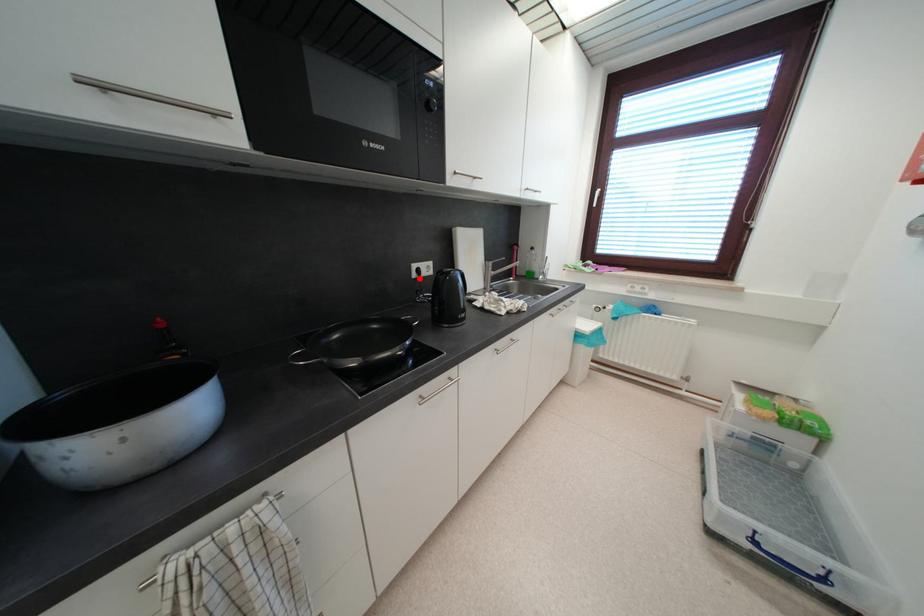
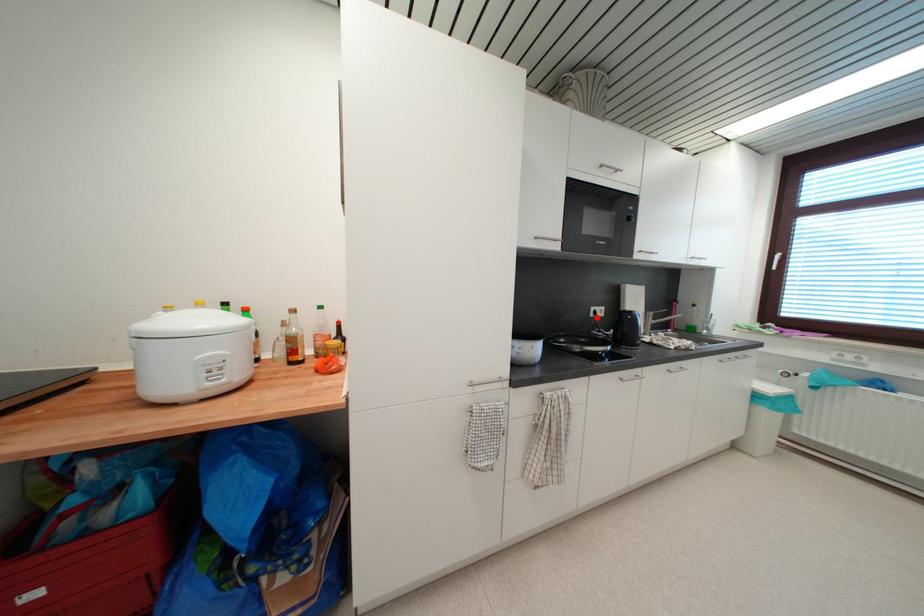
I am providing you with two images of the same scene from different viewpoints. A red point is marked on the first image and another point is marked on the second image. Do the highlighted points in image1 and image2 indicate the same real-world spot?

Yes